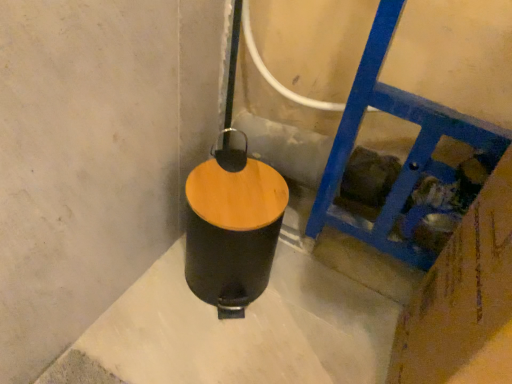
Question: Is blue painted wood at right taller or shorter than black matte waste container at center?

Choices:
 (A) short
 (B) tall

Answer: (B)

Question: Is blue painted wood at right to the left or to the right of black matte waste container at center in the image?

Choices:
 (A) left
 (B) right

Answer: (B)

Question: From the image's perspective, relative to black matte waste container at center, is blue painted wood at right above or below?

Choices:
 (A) below
 (B) above

Answer: (A)

Question: In terms of height, does black matte waste container at center look taller or shorter compared to blue painted wood at right?

Choices:
 (A) short
 (B) tall

Answer: (A)

Question: Relative to blue painted wood at right, is black matte waste container at center in front or behind?

Choices:
 (A) behind
 (B) front

Answer: (A)

Question: Which is correct: black matte waste container at center is inside blue painted wood at right, or outside of it?

Choices:
 (A) inside
 (B) outside

Answer: (B)

Question: Would you say black matte waste container at center is to the left or to the right of blue painted wood at right in the picture?

Choices:
 (A) right
 (B) left

Answer: (B)